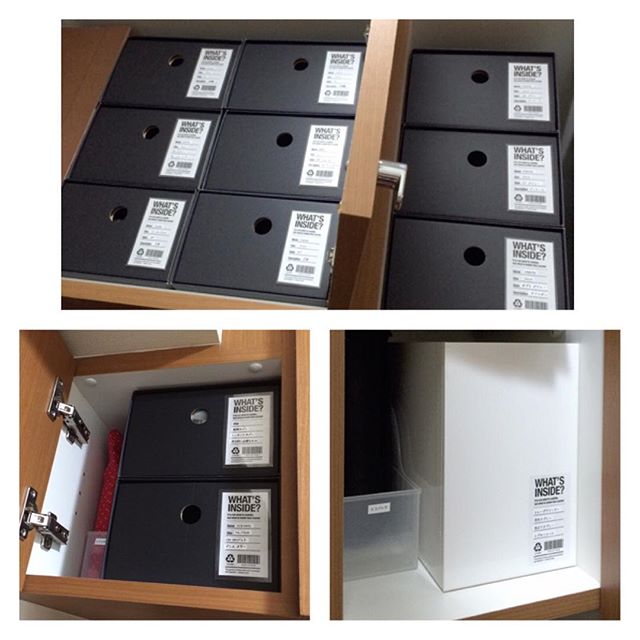
Identify the location of hinges. (75, 424), (48, 525).